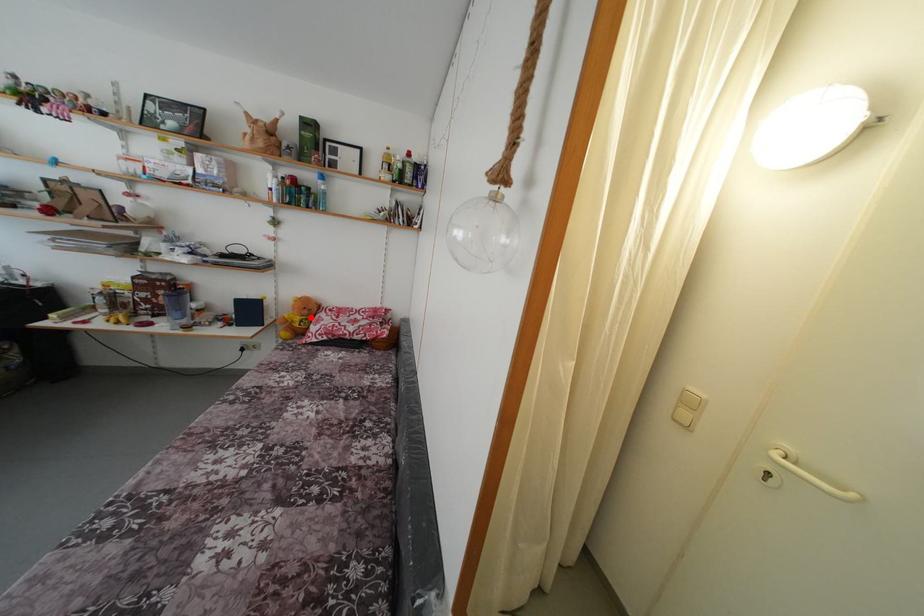
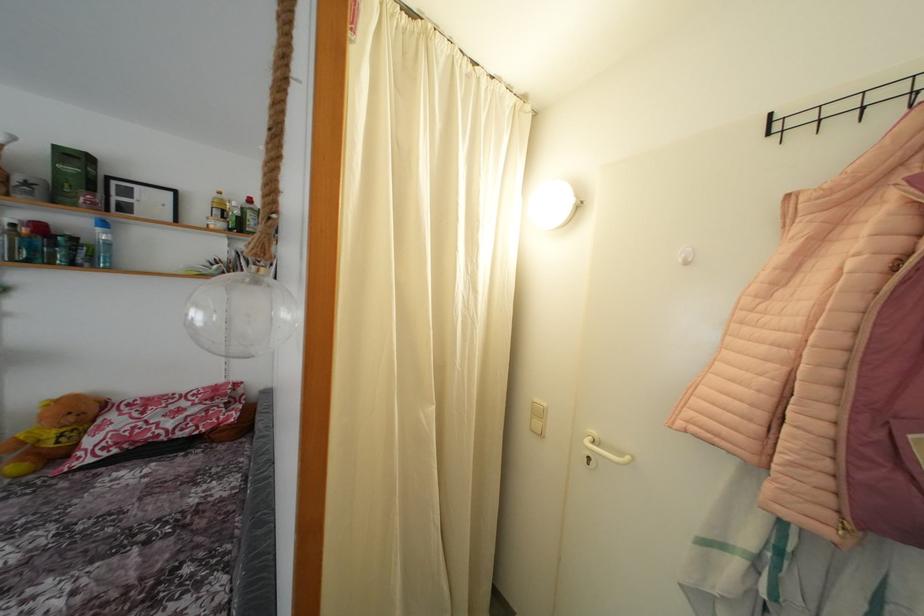
Question: I am providing you with two images of the same scene from different viewpoints. Given a red point in image1, look at the same physical point in image2. Is it:

Choices:
 (A) Closer to the viewpoint
 (B) Farther from the viewpoint

Answer: (A)